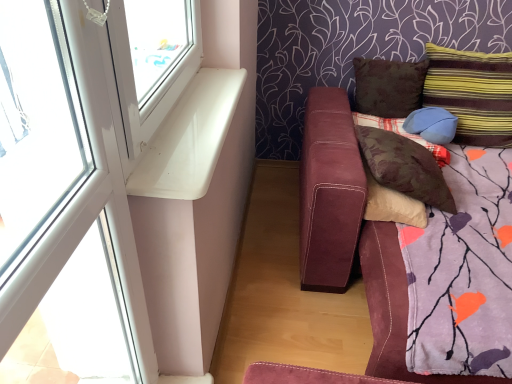
Find the location of `blue fabric pillow at right, acting as the third pillow starting from the right`. blue fabric pillow at right, acting as the third pillow starting from the right is located at coordinates (402, 134).

Where is `brown fabric pillow at center, the 1th pillow viewed from the left`? This screenshot has height=384, width=512. brown fabric pillow at center, the 1th pillow viewed from the left is located at coordinates (404, 167).

Image resolution: width=512 pixels, height=384 pixels. Find the location of `white glossy window sill at upper left`. white glossy window sill at upper left is located at coordinates (189, 138).

Between striped fabric pillow at upper right, the first pillow from the right, and blue fabric pillow at right, which ranks as the 3th pillow in left-to-right order, which one is positioned behind?

blue fabric pillow at right, which ranks as the 3th pillow in left-to-right order.

Does striped fabric pillow at upper right, which ranks as the 5th pillow in left-to-right order, have a smaller size compared to blue fabric pillow at right, which ranks as the 3th pillow in left-to-right order?

No, striped fabric pillow at upper right, which ranks as the 5th pillow in left-to-right order, is not smaller than blue fabric pillow at right, which ranks as the 3th pillow in left-to-right order.

Would you consider striped fabric pillow at upper right, which ranks as the 5th pillow in left-to-right order, to be distant from blue fabric pillow at right, acting as the third pillow starting from the right?

Actually, striped fabric pillow at upper right, which ranks as the 5th pillow in left-to-right order, and blue fabric pillow at right, acting as the third pillow starting from the right, are a little close together.

Is striped fabric pillow at upper right, the first pillow from the right, oriented towards blue fabric pillow at right, acting as the third pillow starting from the right?

No, striped fabric pillow at upper right, the first pillow from the right, is not oriented towards blue fabric pillow at right, acting as the third pillow starting from the right.

Is white glossy window sill at upper left smaller than suede-like maroon couch at lower right?

Yes.

From a real-world perspective, which is physically below, white glossy window sill at upper left or suede-like maroon couch at lower right?

In real-world perspective, suede-like maroon couch at lower right is lower.

Locate an element on the screen. This screenshot has width=512, height=384. studio couch to the right of white glossy window sill at upper left is located at coordinates (329, 191).

Is white glossy window sill at upper left completely or partially outside of suede-like maroon couch at lower right?

Indeed, white glossy window sill at upper left is completely outside suede-like maroon couch at lower right.

Is striped fabric pillow at upper right, the first pillow from the right, touching suede-like maroon couch at lower right?

striped fabric pillow at upper right, the first pillow from the right, and suede-like maroon couch at lower right are not in contact.

The image size is (512, 384). Find the location of `pillow that is the 5th one above the suede-like maroon couch at lower right (from a real-world perspective)`. pillow that is the 5th one above the suede-like maroon couch at lower right (from a real-world perspective) is located at coordinates (472, 93).

Is suede-like maroon couch at lower right at the back of striped fabric pillow at upper right, which ranks as the 5th pillow in left-to-right order?

No, striped fabric pillow at upper right, which ranks as the 5th pillow in left-to-right order,'s orientation is not away from suede-like maroon couch at lower right.

Which is farther from the camera, (x=457, y=109) or (x=389, y=255)?

The point (x=457, y=109) is farther from the camera.

Is white glossy window sill at upper left looking in the opposite direction of matte blue pillow at upper right, the 4th pillow when ordered from left to right?

No, white glossy window sill at upper left is not facing away from matte blue pillow at upper right, the 4th pillow when ordered from left to right.

From the image's perspective, does white glossy window sill at upper left appear higher than matte blue pillow at upper right, which ranks as the 2th pillow in right-to-left order?

Actually, white glossy window sill at upper left appears below matte blue pillow at upper right, which ranks as the 2th pillow in right-to-left order, in the image.

Does white glossy window sill at upper left have a greater height compared to matte blue pillow at upper right, which ranks as the 2th pillow in right-to-left order?

No.

From the picture: Is white glossy window sill at upper left smaller than matte blue pillow at upper right, the 4th pillow when ordered from left to right?

Yes.

Is striped fabric pillow at upper right, the first pillow from the right, facing towards matte blue pillow at upper right, which ranks as the 2th pillow in right-to-left order?

Yes, striped fabric pillow at upper right, the first pillow from the right, is facing matte blue pillow at upper right, which ranks as the 2th pillow in right-to-left order.

From the image's perspective, is striped fabric pillow at upper right, which ranks as the 5th pillow in left-to-right order, on top of matte blue pillow at upper right, the 4th pillow when ordered from left to right?

Yes, from the image's perspective, striped fabric pillow at upper right, which ranks as the 5th pillow in left-to-right order, is above matte blue pillow at upper right, the 4th pillow when ordered from left to right.

Is striped fabric pillow at upper right, the first pillow from the right, closer to camera compared to matte blue pillow at upper right, which ranks as the 2th pillow in right-to-left order?

Yes, the depth of striped fabric pillow at upper right, the first pillow from the right, is less than that of matte blue pillow at upper right, which ranks as the 2th pillow in right-to-left order.

From a real-world perspective, relative to matte blue pillow at upper right, which ranks as the 2th pillow in right-to-left order, is striped fabric pillow at upper right, the first pillow from the right, vertically above or below?

Clearly, from a real-world perspective, striped fabric pillow at upper right, the first pillow from the right, is above matte blue pillow at upper right, which ranks as the 2th pillow in right-to-left order.

Based on their sizes in the image, would you say white glossy window sill at upper left is bigger or smaller than white plastic window at upper left?

white glossy window sill at upper left is smaller than white plastic window at upper left.

Is point (132, 188) farther from viewer compared to point (4, 182)?

No, it is not.

Is the position of white glossy window sill at upper left less distant than that of white plastic window at upper left?

That is False.

Could you tell me if white plastic window at upper left is turned towards brown fabric pillow at center, the 1th pillow viewed from the left?

No, white plastic window at upper left is not oriented towards brown fabric pillow at center, the 1th pillow viewed from the left.

Do you think white plastic window at upper left is within brown fabric pillow at center, which is the 5th pillow from right to left, or outside of it?

white plastic window at upper left exists outside the volume of brown fabric pillow at center, which is the 5th pillow from right to left.

Between white plastic window at upper left and brown fabric pillow at center, the 1th pillow viewed from the left, which one appears on the right side from the viewer's perspective?

Positioned to the right is brown fabric pillow at center, the 1th pillow viewed from the left.

From the image's perspective, does white plastic window at upper left appear lower than brown fabric pillow at center, the 1th pillow viewed from the left?

A: Indeed, from the image's perspective, white plastic window at upper left is shown beneath brown fabric pillow at center, the 1th pillow viewed from the left.

This screenshot has height=384, width=512. What are the coordinates of `pillow that is the 2nd one when counting downward from the striped fabric pillow at upper right, the first pillow from the right (from the image's perspective)` in the screenshot? It's located at (402, 134).

The image size is (512, 384). Find the location of `window sill above the suede-like maroon couch at lower right (from the image's perspective)`. window sill above the suede-like maroon couch at lower right (from the image's perspective) is located at coordinates (189, 138).

Looking at the image, which one is located further to white glossy window sill at upper left, striped fabric pillow at upper right, the first pillow from the right, or white plastic window at upper left?

Based on the image, striped fabric pillow at upper right, the first pillow from the right, appears to be further to white glossy window sill at upper left.

Estimate the real-world distances between objects in this image. Which object is further from white plastic window at upper left, blue fabric pillow at right, which ranks as the 3th pillow in left-to-right order, or white glossy window sill at upper left?

Among the two, blue fabric pillow at right, which ranks as the 3th pillow in left-to-right order, is located further to white plastic window at upper left.

Based on their spatial positions, is striped fabric pillow at upper right, the first pillow from the right, or brown fabric pillow at upper right, the 2th pillow in the left-to-right sequence, closer to white glossy window sill at upper left?

Among the two, brown fabric pillow at upper right, the 2th pillow in the left-to-right sequence, is located nearer to white glossy window sill at upper left.

From the image, which object appears to be nearer to striped fabric pillow at upper right, which ranks as the 5th pillow in left-to-right order, brown fabric pillow at center, which is the 5th pillow from right to left, or blue fabric pillow at right, acting as the third pillow starting from the right?

The object closer to striped fabric pillow at upper right, which ranks as the 5th pillow in left-to-right order, is blue fabric pillow at right, acting as the third pillow starting from the right.

Consider the image. Based on their spatial positions, is blue fabric pillow at right, acting as the third pillow starting from the right, or brown fabric pillow at upper right, the 2th pillow in the left-to-right sequence, closer to brown fabric pillow at center, which is the 5th pillow from right to left?

The object closer to brown fabric pillow at center, which is the 5th pillow from right to left, is blue fabric pillow at right, acting as the third pillow starting from the right.

From the image, which object appears to be nearer to striped fabric pillow at upper right, which ranks as the 5th pillow in left-to-right order, blue fabric pillow at right, acting as the third pillow starting from the right, or matte blue pillow at upper right, which ranks as the 2th pillow in right-to-left order?

matte blue pillow at upper right, which ranks as the 2th pillow in right-to-left order.

Looking at the image, which one is located closer to blue fabric pillow at right, which ranks as the 3th pillow in left-to-right order, suede-like maroon couch at lower right or matte blue pillow at upper right, which ranks as the 2th pillow in right-to-left order?

matte blue pillow at upper right, which ranks as the 2th pillow in right-to-left order, is positioned closer to the anchor blue fabric pillow at right, which ranks as the 3th pillow in left-to-right order.

Based on their spatial positions, is striped fabric pillow at upper right, which ranks as the 5th pillow in left-to-right order, or suede-like maroon couch at lower right closer to white plastic window at upper left?

suede-like maroon couch at lower right is positioned closer to the anchor white plastic window at upper left.

At what (x,y) coordinates should I click in order to perform the action: click on studio couch positioned between white plastic window at upper left and brown fabric pillow at center, which is the 5th pillow from right to left, from near to far. Please return your answer as a coordinate pair (x, y). The height and width of the screenshot is (384, 512). Looking at the image, I should click on (329, 191).

This screenshot has width=512, height=384. I want to click on studio couch located between white plastic window at upper left and striped fabric pillow at upper right, the first pillow from the right, in the depth direction, so click(x=329, y=191).

Locate an element on the screen. This screenshot has width=512, height=384. pillow located between blue fabric pillow at right, which ranks as the 3th pillow in left-to-right order, and striped fabric pillow at upper right, the first pillow from the right, in the left-right direction is located at coordinates (432, 124).

Where is `window sill located between white plastic window at upper left and blue fabric pillow at right, acting as the third pillow starting from the right, in the depth direction`? window sill located between white plastic window at upper left and blue fabric pillow at right, acting as the third pillow starting from the right, in the depth direction is located at coordinates pyautogui.click(x=189, y=138).